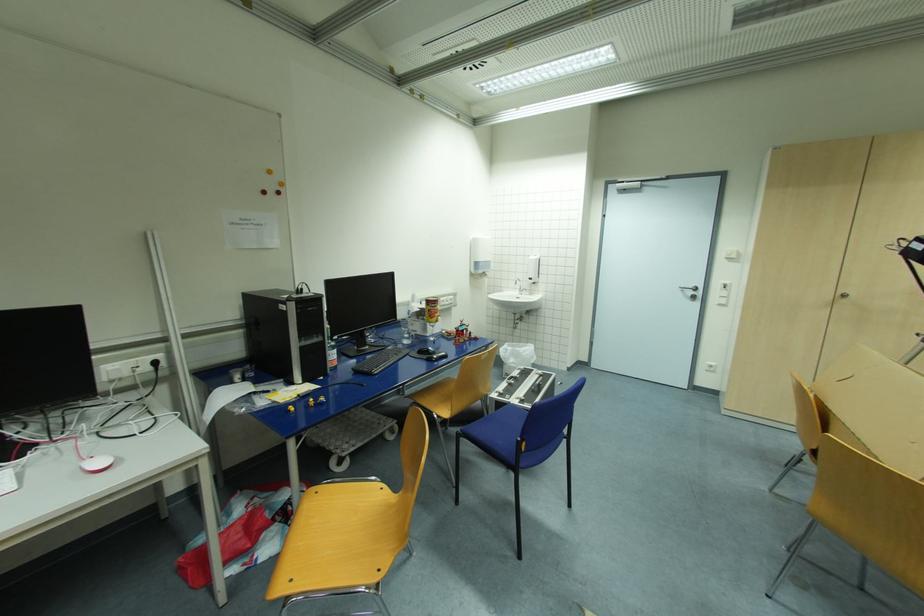
Find where to push the soap dispenser lever. Please return your answer as a coordinate pair (x, y).

(531, 278)